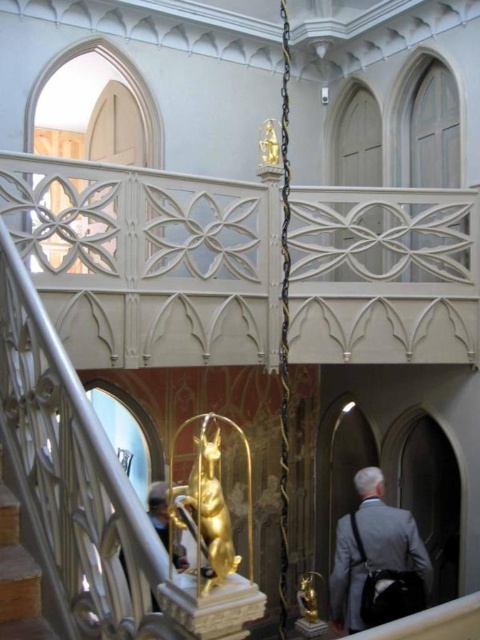
Between gray fabric coat at lower right and wooden at lower left, which one appears on the right side from the viewer's perspective?

gray fabric coat at lower right is more to the right.

Is gray fabric coat at lower right smaller than wooden at lower left?

Actually, gray fabric coat at lower right might be larger than wooden at lower left.

What do you see at coordinates (376, 561) in the screenshot? I see `gray fabric coat at lower right` at bounding box center [376, 561].

Locate an element on the screen. This screenshot has height=640, width=480. gray fabric coat at lower right is located at coordinates (376, 561).

Who is more forward, [203,426] or [33,614]?

Point [203,426] is more forward.

Locate an element on the screen. gold polished statue at center is located at coordinates (210, 504).

Find the location of a particular element. This screenshot has height=640, width=480. gold polished statue at center is located at coordinates (210, 504).

The height and width of the screenshot is (640, 480). I want to click on gold polished statue at center, so click(210, 504).

Is gray fabric coat at lower right below gold polished statue at center?

Actually, gray fabric coat at lower right is above gold polished statue at center.

Does gray fabric coat at lower right have a lesser width compared to gold polished statue at center?

No.

Is point (392, 572) positioned in front of point (201, 573)?

No.

This screenshot has width=480, height=640. I want to click on gray fabric coat at lower right, so click(x=376, y=561).